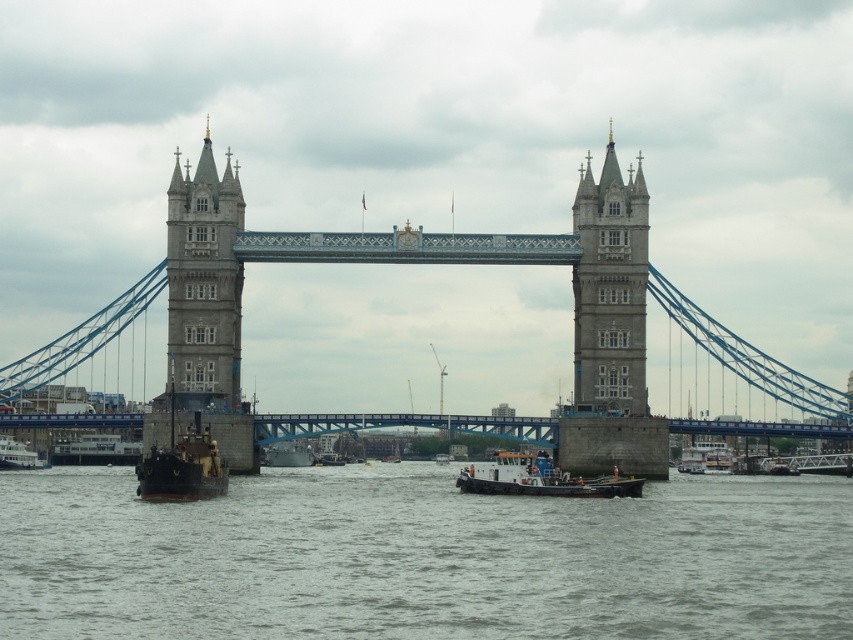
Question: Does white plastic boat at center appear on the right side of metallic gray boat at center?

Choices:
 (A) yes
 (B) no

Answer: (A)

Question: Which point appears closest to the camera in this image?

Choices:
 (A) (200, 232)
 (B) (16, 445)
 (C) (294, 461)

Answer: (A)

Question: Considering the real-world distances, which object is farthest from the metallic gray boat at lower left?

Choices:
 (A) gray stone tower at left
 (B) gray stone tower at center
 (C) stone bridge at center

Answer: (B)

Question: Is metallic gray boat at center to the right of metallic gray boat at lower left from the viewer's perspective?

Choices:
 (A) no
 (B) yes

Answer: (B)

Question: Does gray stone tower at center have a greater width compared to white plastic boat at center?

Choices:
 (A) no
 (B) yes

Answer: (A)

Question: Which point is closer to the camera taking this photo?

Choices:
 (A) coord(254,260)
 (B) coord(33,454)

Answer: (A)